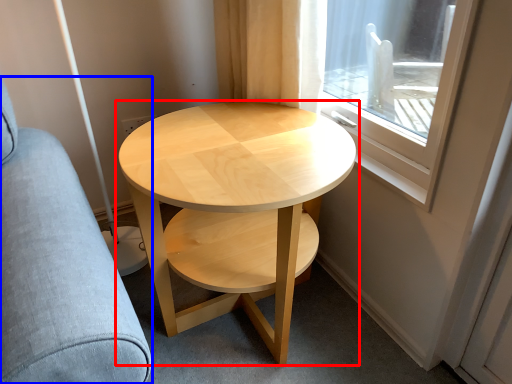
Question: Which of the following is the farthest to the observer, coffee table (highlighted by a red box) or swivel chair (highlighted by a blue box)?

Choices:
 (A) coffee table
 (B) swivel chair

Answer: (A)